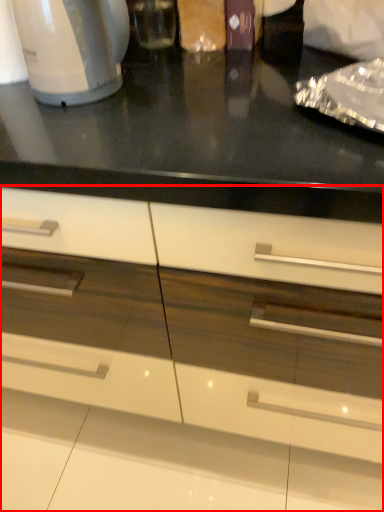
Question: From the image's perspective, where is cabinetry (annotated by the red box) located in relation to home appliance in the image?

Choices:
 (A) below
 (B) above

Answer: (A)